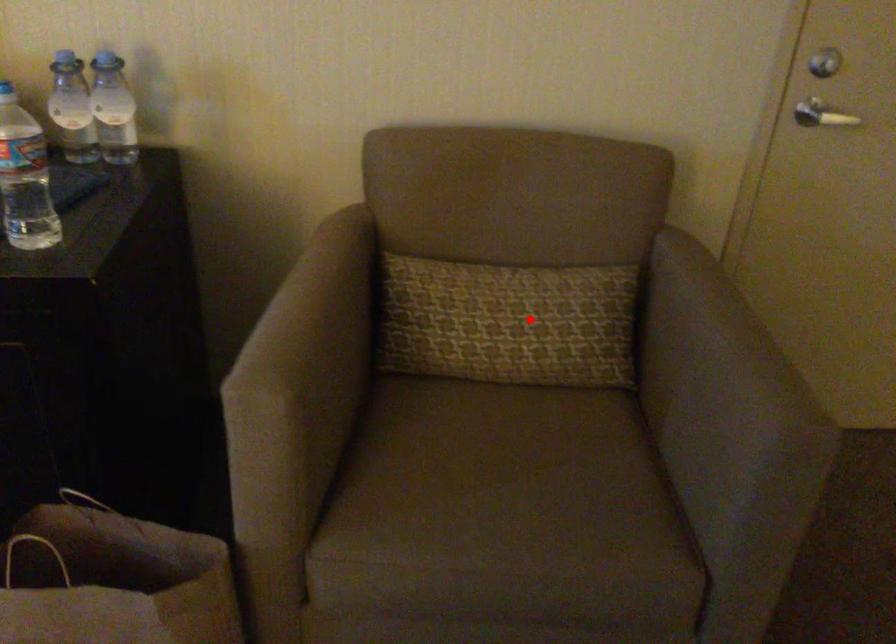
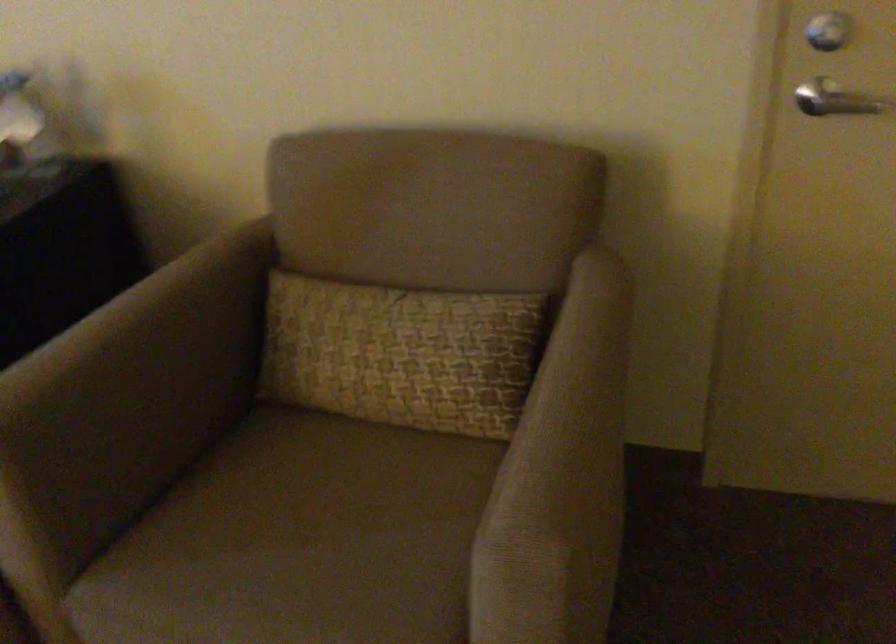
Question: A red point is marked in image1. In image2, is the corresponding 3D point closer to the camera or farther? Reply with the corresponding letter.

Choices:
 (A) The corresponding 3D point is closer.
 (B) The corresponding 3D point is farther.

Answer: (A)